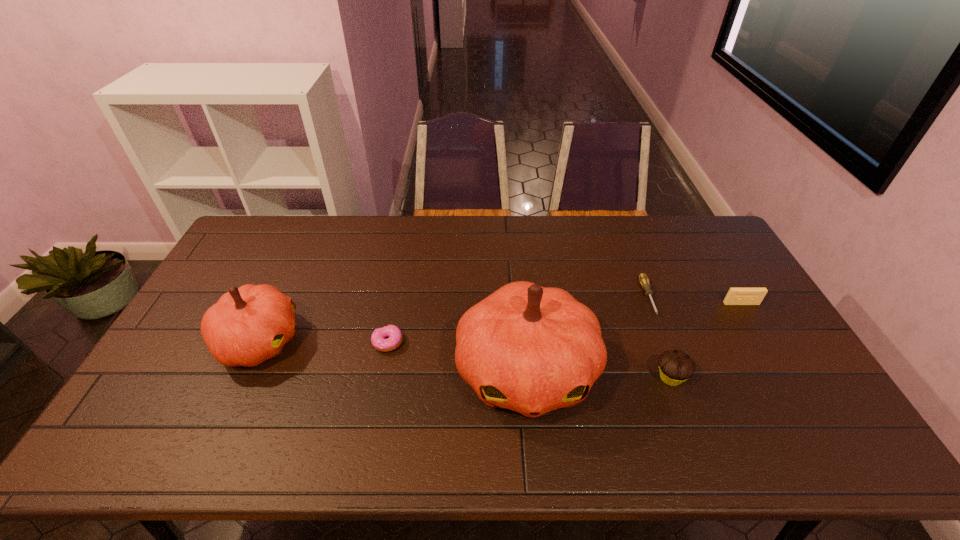
The height and width of the screenshot is (540, 960). Find the location of `free space located on the front-facing side of the left pumpkin`. free space located on the front-facing side of the left pumpkin is located at coordinates (417, 341).

Locate an element on the screen. This screenshot has height=540, width=960. vacant space located 0.170m at the tip of the screwdriver is located at coordinates (674, 365).

Where is `vacant point located on the back of the second shortest object`? The width and height of the screenshot is (960, 540). vacant point located on the back of the second shortest object is located at coordinates (404, 258).

Where is `free space located at the front of the videotape with spools`? free space located at the front of the videotape with spools is located at coordinates (809, 417).

What are the coordinates of `free location located on the left of the muffin` in the screenshot? It's located at (605, 378).

Image resolution: width=960 pixels, height=540 pixels. In order to click on pumpkin present at the near edge in this screenshot , I will do `click(531, 349)`.

The image size is (960, 540). In order to click on muffin that is positioned at the near edge in this screenshot , I will do `click(676, 366)`.

What are the coordinates of `object that is positioned at the left edge` in the screenshot? It's located at (248, 325).

I want to click on object positioned at the right edge, so click(x=736, y=296).

At what (x,y) coordinates should I click in order to perform the action: click on free space at the far edge of the desktop. Please return your answer as a coordinate pair (x, y). This screenshot has width=960, height=540. Looking at the image, I should click on (427, 236).